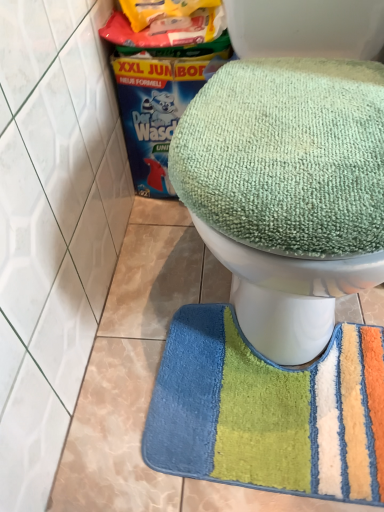
Question: Is green fabric toilet at upper center in front of or behind multicolored plush bath mat at lower center in the image?

Choices:
 (A) front
 (B) behind

Answer: (A)

Question: Considering the positions of point (350, 186) and point (271, 373), is point (350, 186) closer or farther from the camera than point (271, 373)?

Choices:
 (A) farther
 (B) closer

Answer: (B)

Question: From a real-world perspective, is green fabric toilet at upper center above or below multicolored plush bath mat at lower center?

Choices:
 (A) below
 (B) above

Answer: (B)

Question: From a real-world perspective, relative to green fabric toilet at upper center, is multicolored plush bath mat at lower center vertically above or below?

Choices:
 (A) above
 (B) below

Answer: (B)

Question: From the image's perspective, relative to green fabric toilet at upper center, is multicolored plush bath mat at lower center above or below?

Choices:
 (A) below
 (B) above

Answer: (A)

Question: Considering their positions, is multicolored plush bath mat at lower center located in front of or behind green fabric toilet at upper center?

Choices:
 (A) front
 (B) behind

Answer: (B)

Question: Looking at the image, does multicolored plush bath mat at lower center seem bigger or smaller compared to green fabric toilet at upper center?

Choices:
 (A) small
 (B) big

Answer: (A)